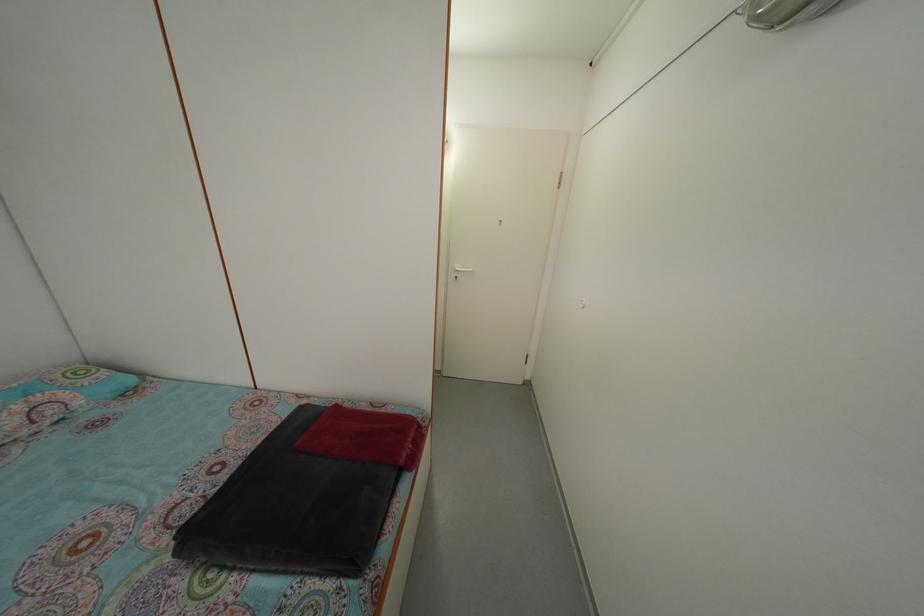
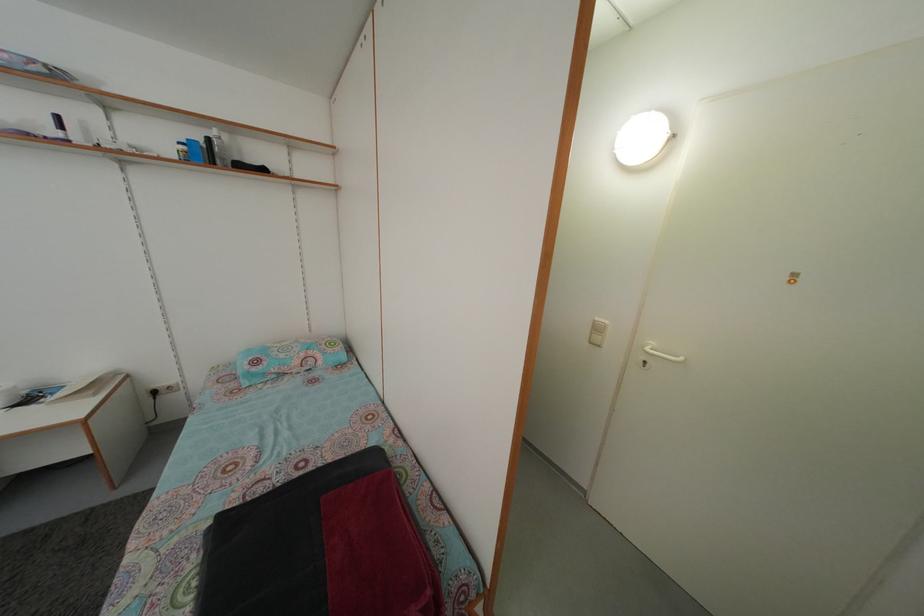
Question: The camera is either moving clockwise (left) or counter-clockwise (right) around the object. The first image is from the beginning of the video and the second image is from the end. Is the camera moving left or right when shooting the video?

Choices:
 (A) Left
 (B) Right

Answer: (B)